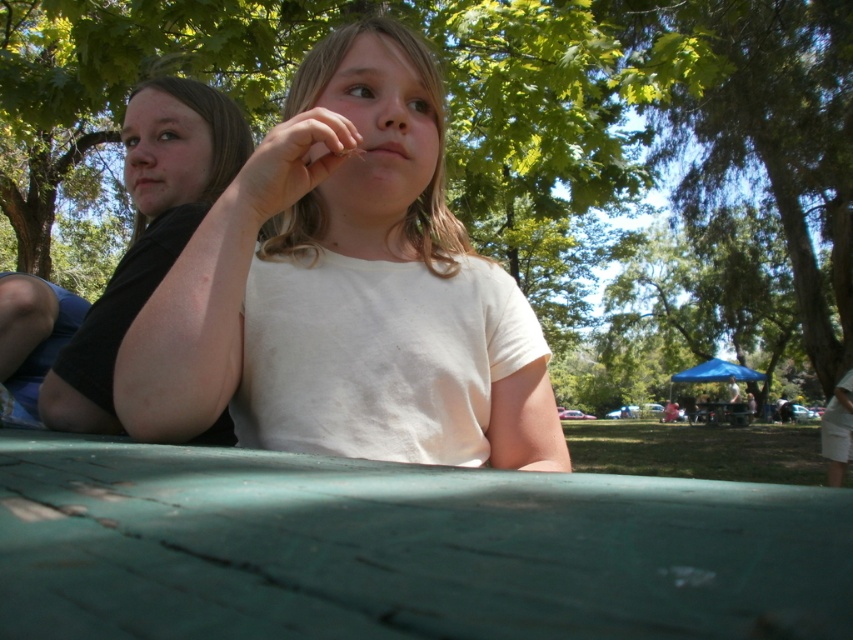
Question: Considering the relative positions of green leafy tree at center and black matte shirt at left in the image provided, where is green leafy tree at center located with respect to black matte shirt at left?

Choices:
 (A) above
 (B) below

Answer: (A)

Question: Considering the real-world distances, which object is farthest from the smooth skin hand at center?

Choices:
 (A) black matte shirt at left
 (B) white matte shirt at center
 (C) green leafy tree at center

Answer: (C)

Question: Is white matte shirt at center above black matte shirt at left?

Choices:
 (A) yes
 (B) no

Answer: (A)

Question: Is black matte shirt at left smaller than smooth skin hand at center?

Choices:
 (A) yes
 (B) no

Answer: (B)

Question: Which point is closer to the camera?

Choices:
 (A) (315, 68)
 (B) (93, 140)
 (C) (300, 140)
 (D) (106, 378)

Answer: (C)

Question: Which of the following is the closest to the observer?

Choices:
 (A) pos(517,12)
 (B) pos(223,300)

Answer: (B)